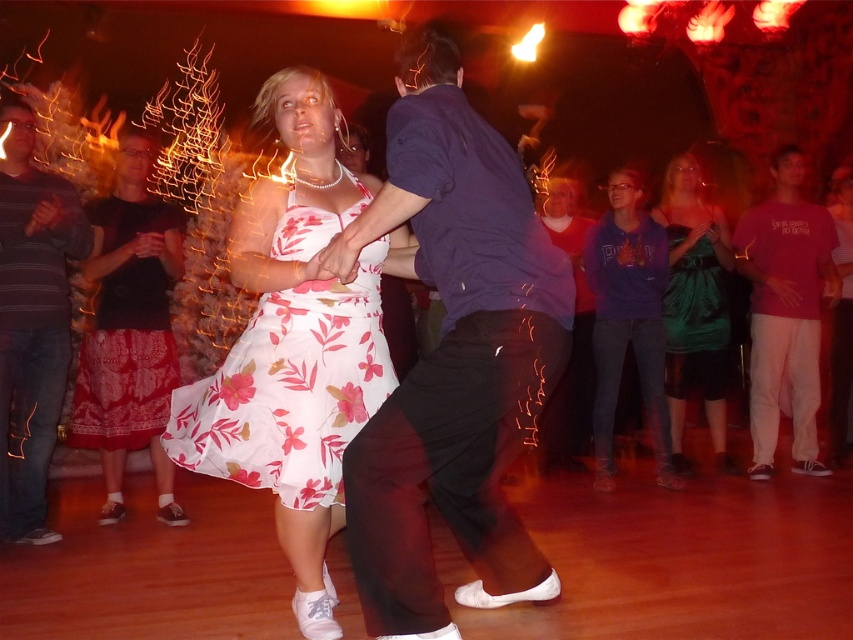
This screenshot has width=853, height=640. I want to click on dark blue shirt at center, so click(x=453, y=356).

Can you confirm if dark blue shirt at center is taller than purple hoodie at center?

Yes, dark blue shirt at center is taller than purple hoodie at center.

Measure the distance between dark blue shirt at center and camera.

dark blue shirt at center is 5.76 feet from camera.

Where is `dark blue shirt at center`? The width and height of the screenshot is (853, 640). dark blue shirt at center is located at coordinates (453, 356).

Does white floral fabric dress at center have a smaller size compared to pink cotton t-shirt at right?

Indeed, white floral fabric dress at center has a smaller size compared to pink cotton t-shirt at right.

Is white floral fabric dress at center positioned in front of pink cotton t-shirt at right?

Yes, white floral fabric dress at center is in front of pink cotton t-shirt at right.

Is point (305, 504) positioned after point (757, 328)?

That is False.

Locate an element on the screen. This screenshot has height=640, width=853. white floral fabric dress at center is located at coordinates (289, 388).

Is white floral fabric dress at center thinner than floral cotton dress at left?

In fact, white floral fabric dress at center might be wider than floral cotton dress at left.

Does white floral fabric dress at center have a greater height compared to floral cotton dress at left?

No.

Describe the element at coordinates (289, 388) in the screenshot. The width and height of the screenshot is (853, 640). I see `white floral fabric dress at center` at that location.

Where is `white floral fabric dress at center`? white floral fabric dress at center is located at coordinates (289, 388).